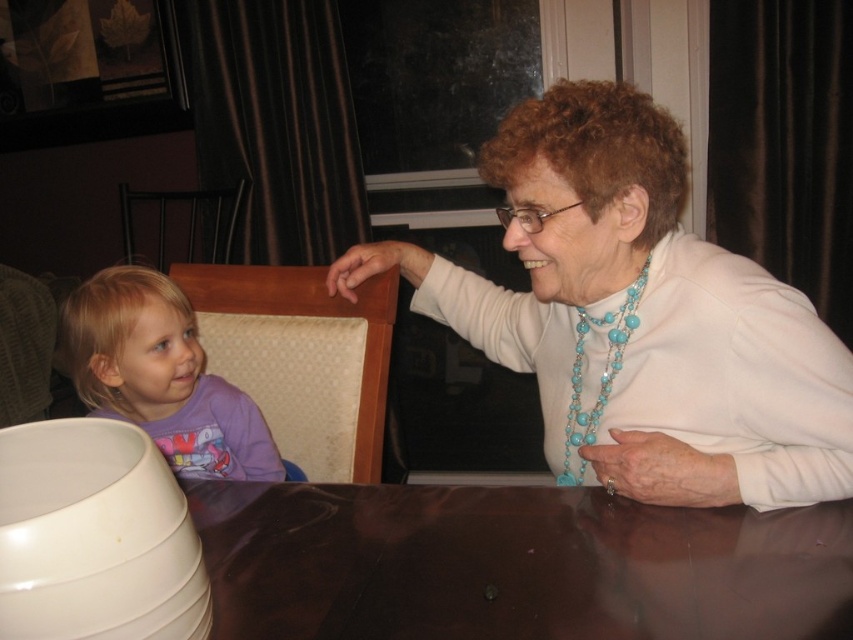
Question: Which point is closer to the camera?

Choices:
 (A) glossy brown table at center
 (B) white glossy sweater at upper right
 (C) purple cotton shirt at left

Answer: (A)

Question: Which of the following is the closest to the observer?

Choices:
 (A) glossy brown table at center
 (B) white glossy sweater at upper right
 (C) purple cotton shirt at left

Answer: (A)

Question: Is white glossy sweater at upper right positioned before glossy brown table at center?

Choices:
 (A) yes
 (B) no

Answer: (B)

Question: In this image, where is white glossy sweater at upper right located relative to glossy brown table at center?

Choices:
 (A) above
 (B) below

Answer: (A)

Question: Which point appears farthest from the camera in this image?

Choices:
 (A) (68, 348)
 (B) (587, 99)
 (C) (675, 515)

Answer: (A)

Question: Does white glossy sweater at upper right have a greater width compared to glossy brown table at center?

Choices:
 (A) no
 (B) yes

Answer: (A)